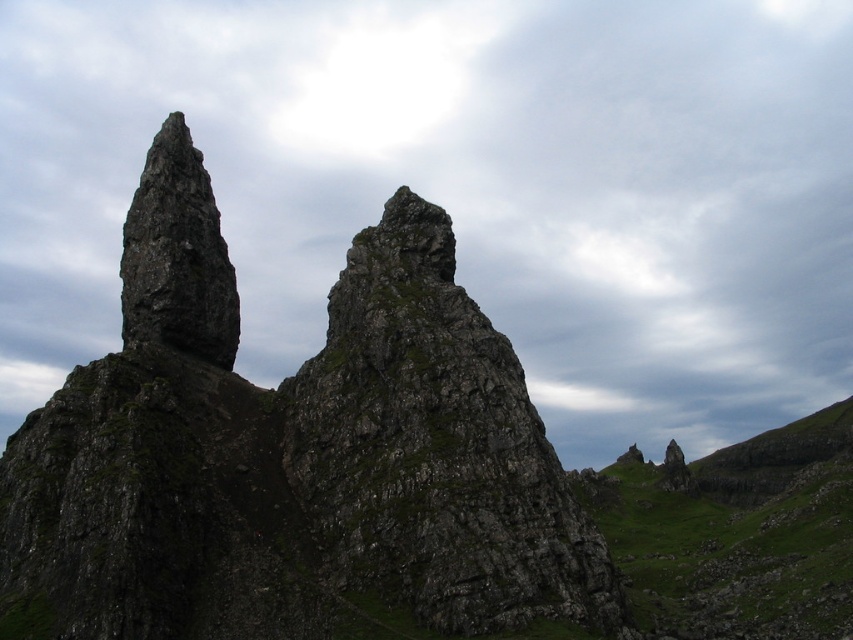
Which is more to the right, rough stone rock at center or green grassy hillside at upper center?

green grassy hillside at upper center is more to the right.

Which is more to the left, rough stone rock at center or green grassy hillside at upper center?

rough stone rock at center

Describe the element at coordinates (434, 449) in the screenshot. I see `rough stone rock at center` at that location.

The height and width of the screenshot is (640, 853). In order to click on rough stone rock at center in this screenshot , I will do `click(434, 449)`.

Between gray cloudy sky at upper center and rough stone peak at left, which one is positioned higher?

Positioned higher is gray cloudy sky at upper center.

Is point (766, 232) positioned in front of point (202, 166)?

No.

At what (x,y) coordinates should I click in order to perform the action: click on gray cloudy sky at upper center. Please return your answer as a coordinate pair (x, y). Image resolution: width=853 pixels, height=640 pixels. Looking at the image, I should click on (462, 188).

Can you confirm if rough stone rock formation at center is positioned to the right of green grassy hillside at upper center?

In fact, rough stone rock formation at center is to the left of green grassy hillside at upper center.

The width and height of the screenshot is (853, 640). Find the location of `rough stone rock formation at center`. rough stone rock formation at center is located at coordinates (291, 452).

At what (x,y) coordinates should I click in order to perform the action: click on rough stone rock formation at center. Please return your answer as a coordinate pair (x, y). The height and width of the screenshot is (640, 853). Looking at the image, I should click on (291, 452).